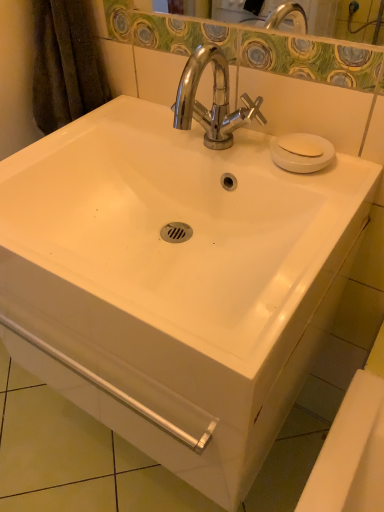
Find the location of a particular element. The image size is (384, 512). vacant space in front of white matte soap at upper right is located at coordinates (x=322, y=187).